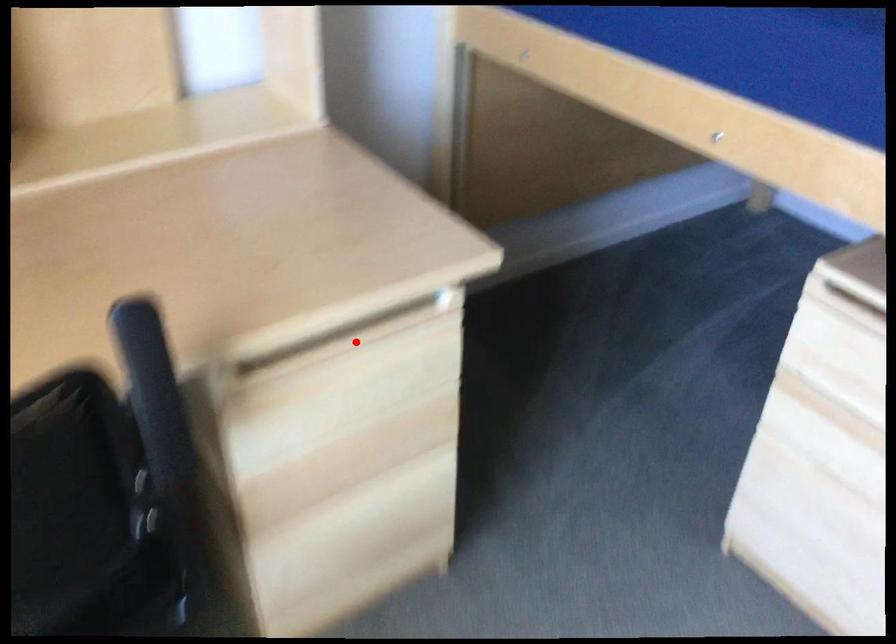
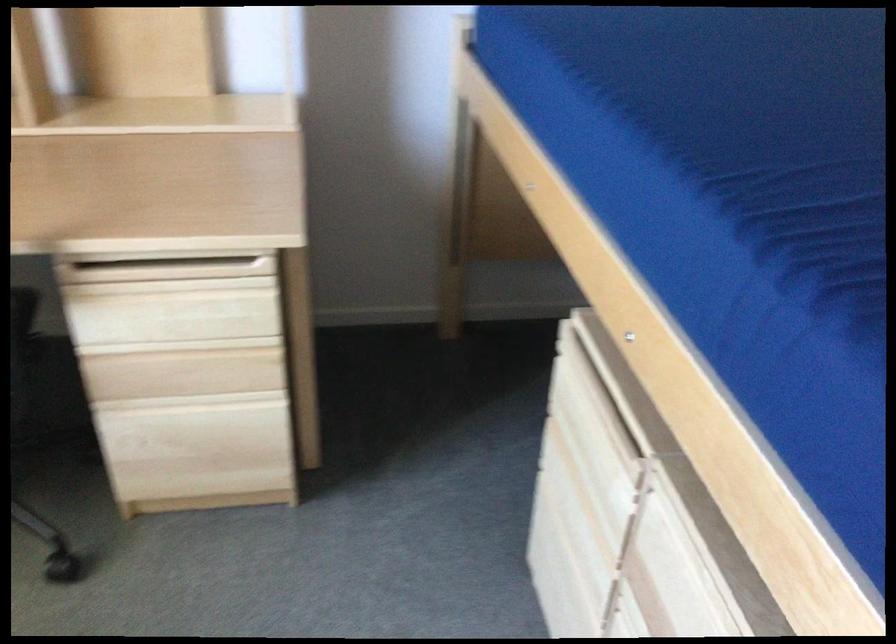
Find the pixel in the second image that matches the highlighted location in the first image.

(166, 270)